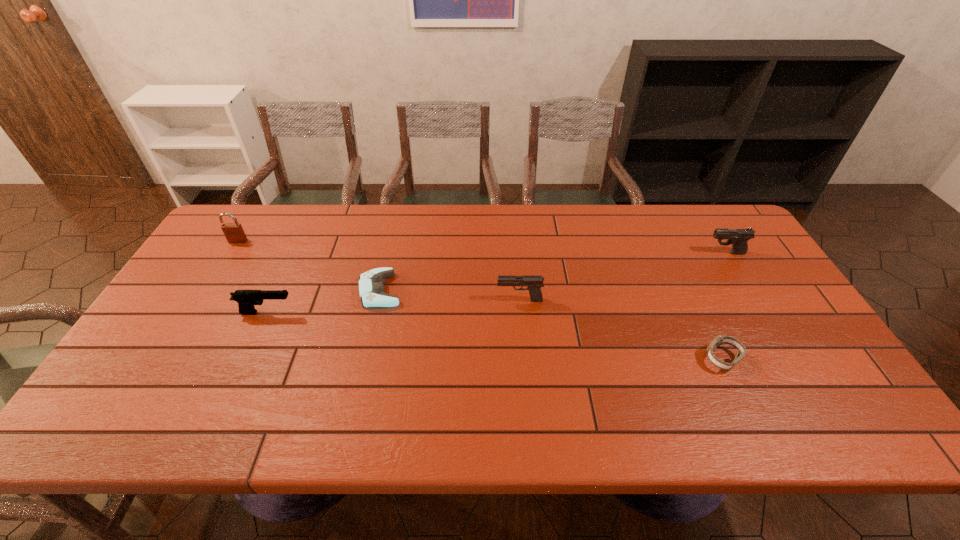
Identify the location of unoccupied area between the rightmost pistol and the shortest object. This screenshot has height=540, width=960. (553, 272).

You are a GUI agent. You are given a task and a screenshot of the screen. Output one action in this format:
    pyautogui.click(x=<x>, y=<y>)
    Task: Click on the empty location between the farthest object and the leftmost pistol
    This screenshot has width=960, height=540.
    Given the screenshot: What is the action you would take?
    pyautogui.click(x=252, y=276)

Locate an element on the screen. This screenshot has width=960, height=540. empty space that is in between the second farthest pistol and the control is located at coordinates (450, 295).

Locate an element on the screen. The image size is (960, 540). the second closest object to the nearest pistol is located at coordinates (234, 233).

Identify the location of object that is the second nearest to the second nearest pistol. Image resolution: width=960 pixels, height=540 pixels. (720, 339).

Where is `pistol identified as the second closest to the leftmost pistol`? The image size is (960, 540). pistol identified as the second closest to the leftmost pistol is located at coordinates (738, 237).

Locate which pistol ranks second in proximity to the rightmost pistol. Please provide its 2D coordinates. Your answer should be formatted as a tuple, i.e. [(x, y)], where the tuple contains the x and y coordinates of a point satisfying the conditions above.

[(246, 299)]